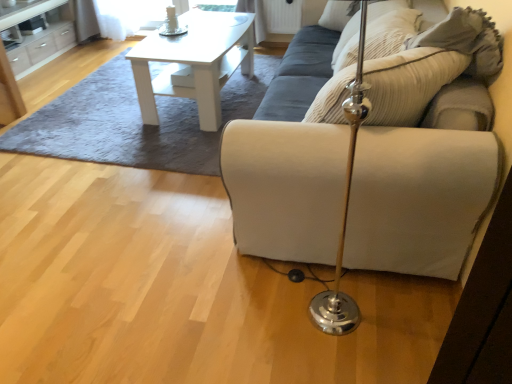
The image size is (512, 384). What do you see at coordinates (420, 199) in the screenshot?
I see `beige fabric couch at center` at bounding box center [420, 199].

Where is `white matte table at upper center`? The width and height of the screenshot is (512, 384). white matte table at upper center is located at coordinates (195, 62).

In the scene shown: Would you consider suede beige pillow at upper right, which is counted as the 2th pillow, starting from the back, to be distant from white matte table at upper center?

suede beige pillow at upper right, which is counted as the 2th pillow, starting from the back, is actually quite close to white matte table at upper center.

Choose the correct answer: Is suede beige pillow at upper right, arranged as the 1th pillow when viewed from the front, inside white matte table at upper center or outside it?

suede beige pillow at upper right, arranged as the 1th pillow when viewed from the front, cannot be found inside white matte table at upper center.

Which is behind, suede beige pillow at upper right, arranged as the 1th pillow when viewed from the front, or white matte table at upper center?

suede beige pillow at upper right, arranged as the 1th pillow when viewed from the front, is behind.

Considering the sizes of suede beige pillow at upper right, which is counted as the 2th pillow, starting from the back, and white matte table at upper center in the image, is suede beige pillow at upper right, which is counted as the 2th pillow, starting from the back, wider or thinner than white matte table at upper center?

suede beige pillow at upper right, which is counted as the 2th pillow, starting from the back, is thinner than white matte table at upper center.

From their relative heights in the image, would you say beige fabric couch at center is taller or shorter than white matte table at upper center?

Considering their sizes, beige fabric couch at center has more height than white matte table at upper center.

The width and height of the screenshot is (512, 384). I want to click on studio couch above the white matte table at upper center (from a real-world perspective), so click(x=420, y=199).

Looking at the image, does beige fabric couch at center seem bigger or smaller compared to white matte table at upper center?

In the image, beige fabric couch at center appears to be larger than white matte table at upper center.

From the image's perspective, is beige fabric couch at center over white matte table at upper center?

No, from the image's perspective, beige fabric couch at center is not above white matte table at upper center.

From the image's perspective, is suede beige pillow at upper right, arranged as the 1th pillow when viewed from the front, below beige fabric couch at center?

No, from the image's perspective, suede beige pillow at upper right, arranged as the 1th pillow when viewed from the front, is not beneath beige fabric couch at center.

Can you tell me how much suede beige pillow at upper right, arranged as the 1th pillow when viewed from the front, and beige fabric couch at center differ in facing direction?

51.7 degrees.

Does point (332, 0) come in front of point (280, 256)?

That is False.

Who is shorter, beige corduroy pillow at upper right, the 1th pillow in the back-to-front sequence, or beige fabric couch at center?

beige corduroy pillow at upper right, the 1th pillow in the back-to-front sequence.

Is beige fabric couch at center at the back of beige corduroy pillow at upper right, the 1th pillow in the back-to-front sequence?

Yes.

Can you tell me how much beige corduroy pillow at upper right, placed as the second pillow when sorted from front to back, and beige fabric couch at center differ in facing direction?

The angular difference between beige corduroy pillow at upper right, placed as the second pillow when sorted from front to back, and beige fabric couch at center is 51.7 degrees.

Is beige corduroy pillow at upper right, placed as the second pillow when sorted from front to back, further to camera compared to beige fabric couch at center?

Yes, beige corduroy pillow at upper right, placed as the second pillow when sorted from front to back, is further from the camera.

Can you confirm if white matte table at upper center is wider than suede beige pillow at upper right, which is counted as the 2th pillow, starting from the back?

Yes.

Image resolution: width=512 pixels, height=384 pixels. I want to click on the 2nd pillow to the right of the white matte table at upper center, counting from the anchor's position, so click(335, 15).

From a real-world perspective, between white matte table at upper center and suede beige pillow at upper right, arranged as the 1th pillow when viewed from the front, who is vertically higher?

suede beige pillow at upper right, arranged as the 1th pillow when viewed from the front.

Is white matte table at upper center oriented towards suede beige pillow at upper right, arranged as the 1th pillow when viewed from the front?

No, white matte table at upper center does not turn towards suede beige pillow at upper right, arranged as the 1th pillow when viewed from the front.

Between beige corduroy pillow at upper right, the 1th pillow in the back-to-front sequence, and suede beige pillow at upper right, which is counted as the 2th pillow, starting from the back, which one appears on the right side from the viewer's perspective?

From the viewer's perspective, suede beige pillow at upper right, which is counted as the 2th pillow, starting from the back, appears more on the right side.

Looking at this image, which is more distant, (407,31) or (368,11)?

The point (368,11) is farther from the camera.

Identify the location of pillow below the beige corduroy pillow at upper right, the 1th pillow in the back-to-front sequence (from the image's perspective). (335, 15).

Does beige corduroy pillow at upper right, the 1th pillow in the back-to-front sequence, have a lesser width compared to suede beige pillow at upper right, which is counted as the 2th pillow, starting from the back?

Incorrect, the width of beige corduroy pillow at upper right, the 1th pillow in the back-to-front sequence, is not less than that of suede beige pillow at upper right, which is counted as the 2th pillow, starting from the back.

Is white matte table at upper center positioned far away from beige fabric couch at center?

white matte table at upper center is positioned a significant distance from beige fabric couch at center.

Can you confirm if white matte table at upper center is positioned to the left of beige fabric couch at center?

Yes, white matte table at upper center is to the left of beige fabric couch at center.

From a real-world perspective, is white matte table at upper center above or below beige fabric couch at center?

In terms of real-world spatial position, white matte table at upper center is below beige fabric couch at center.

Identify the location of table located underneath the beige fabric couch at center (from a real-world perspective). (195, 62).

The height and width of the screenshot is (384, 512). What are the coordinates of `table that appears in front of the suede beige pillow at upper right, arranged as the 1th pillow when viewed from the front` in the screenshot? It's located at (195, 62).

Find the location of a particular element. The width and height of the screenshot is (512, 384). table above the beige fabric couch at center (from the image's perspective) is located at coordinates (195, 62).

Which object lies nearer to the anchor point white matte table at upper center, beige corduroy pillow at upper right, placed as the second pillow when sorted from front to back, or suede beige pillow at upper right, arranged as the 1th pillow when viewed from the front?

suede beige pillow at upper right, arranged as the 1th pillow when viewed from the front.

Which object lies further to the anchor point white matte table at upper center, suede beige pillow at upper right, which is counted as the 2th pillow, starting from the back, or beige corduroy pillow at upper right, placed as the second pillow when sorted from front to back?

Among the two, beige corduroy pillow at upper right, placed as the second pillow when sorted from front to back, is located further to white matte table at upper center.

When comparing their distances from beige corduroy pillow at upper right, placed as the second pillow when sorted from front to back, does white matte table at upper center or suede beige pillow at upper right, arranged as the 1th pillow when viewed from the front, seem further?

white matte table at upper center is further to beige corduroy pillow at upper right, placed as the second pillow when sorted from front to back.

Estimate the real-world distances between objects in this image. Which object is closer to beige corduroy pillow at upper right, placed as the second pillow when sorted from front to back, beige fabric couch at center or suede beige pillow at upper right, which is counted as the 2th pillow, starting from the back?

beige fabric couch at center.

In the scene shown: From the image, which object appears to be nearer to beige fabric couch at center, beige corduroy pillow at upper right, placed as the second pillow when sorted from front to back, or suede beige pillow at upper right, which is counted as the 2th pillow, starting from the back?

Based on the image, beige corduroy pillow at upper right, placed as the second pillow when sorted from front to back, appears to be nearer to beige fabric couch at center.

Looking at the image, which one is located closer to beige fabric couch at center, beige corduroy pillow at upper right, the 1th pillow in the back-to-front sequence, or white matte table at upper center?

beige corduroy pillow at upper right, the 1th pillow in the back-to-front sequence.

Considering their positions, is beige fabric couch at center positioned further to white matte table at upper center than beige corduroy pillow at upper right, the 1th pillow in the back-to-front sequence?

beige fabric couch at center.

From the image, which object appears to be farther from suede beige pillow at upper right, which is counted as the 2th pillow, starting from the back, beige fabric couch at center or beige corduroy pillow at upper right, the 1th pillow in the back-to-front sequence?

beige fabric couch at center is further to suede beige pillow at upper right, which is counted as the 2th pillow, starting from the back.

Identify the location of table between beige fabric couch at center and beige corduroy pillow at upper right, placed as the second pillow when sorted from front to back, along the z-axis. (195, 62).

Locate an element on the screen. pillow located between white matte table at upper center and suede beige pillow at upper right, which is counted as the 2th pillow, starting from the back, in the left-right direction is located at coordinates (390, 32).

At what (x,y) coordinates should I click in order to perform the action: click on pillow positioned between beige fabric couch at center and beige corduroy pillow at upper right, the 1th pillow in the back-to-front sequence, from near to far. Please return your answer as a coordinate pair (x, y). The height and width of the screenshot is (384, 512). Looking at the image, I should click on (335, 15).

Where is `table between beige fabric couch at center and suede beige pillow at upper right, arranged as the 1th pillow when viewed from the front, along the z-axis`? This screenshot has width=512, height=384. table between beige fabric couch at center and suede beige pillow at upper right, arranged as the 1th pillow when viewed from the front, along the z-axis is located at coordinates (195, 62).